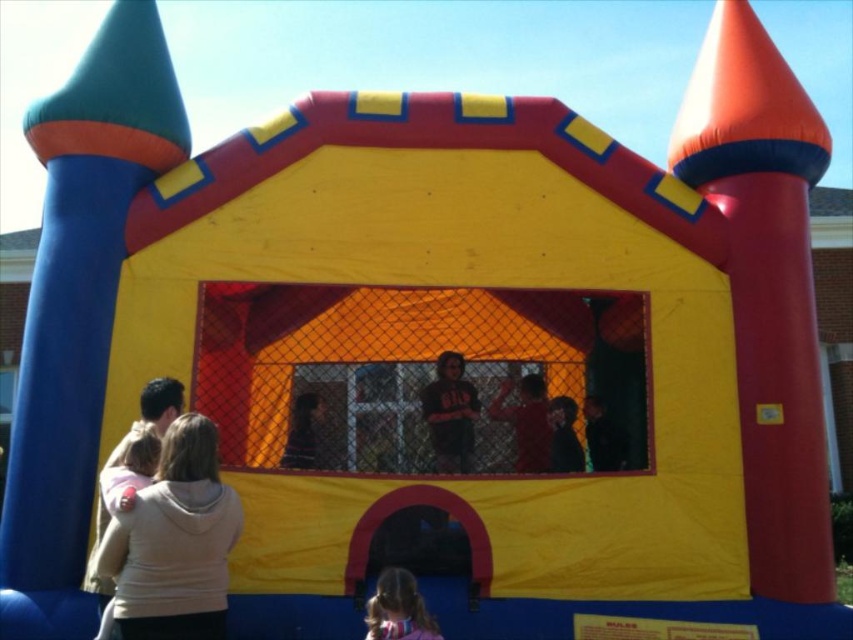
Which is more to the left, beige fleece jacket at lower left or smooth pink hair at lower center?

beige fleece jacket at lower left is more to the left.

Does beige fleece jacket at lower left have a larger size compared to smooth pink hair at lower center?

Yes.

The image size is (853, 640). What do you see at coordinates (173, 541) in the screenshot?
I see `beige fleece jacket at lower left` at bounding box center [173, 541].

Find the location of a particular element. beige fleece jacket at lower left is located at coordinates (173, 541).